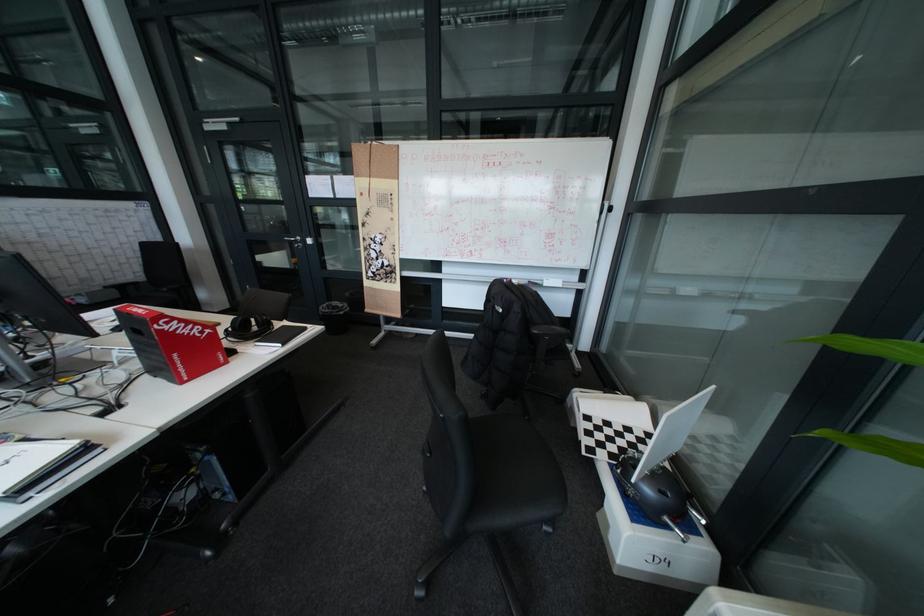
Where would you lift the red cardboard box? Please return your answer as a coordinate pair (x, y).

(171, 342)